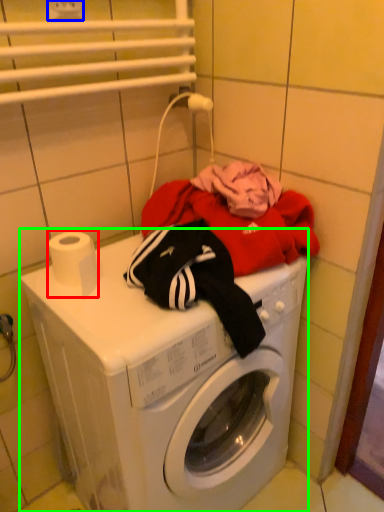
Question: Estimate the real-world distances between objects in this image. Which object is farther from toilet paper (highlighted by a red box), electric outlet (highlighted by a blue box) or washing machine (highlighted by a green box)?

Choices:
 (A) electric outlet
 (B) washing machine

Answer: (A)